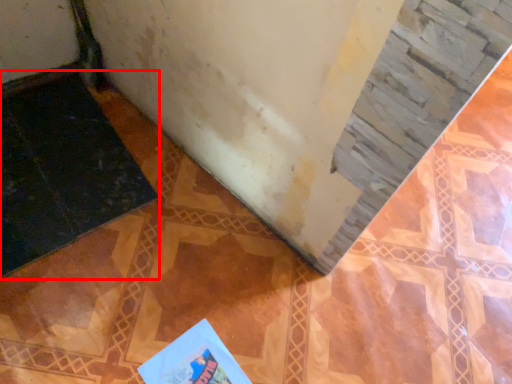
Question: From the image's perspective, considering the relative positions of doormat (annotated by the red box) and book in the image provided, where is doormat (annotated by the red box) located with respect to the staircase?

Choices:
 (A) above
 (B) below

Answer: (A)